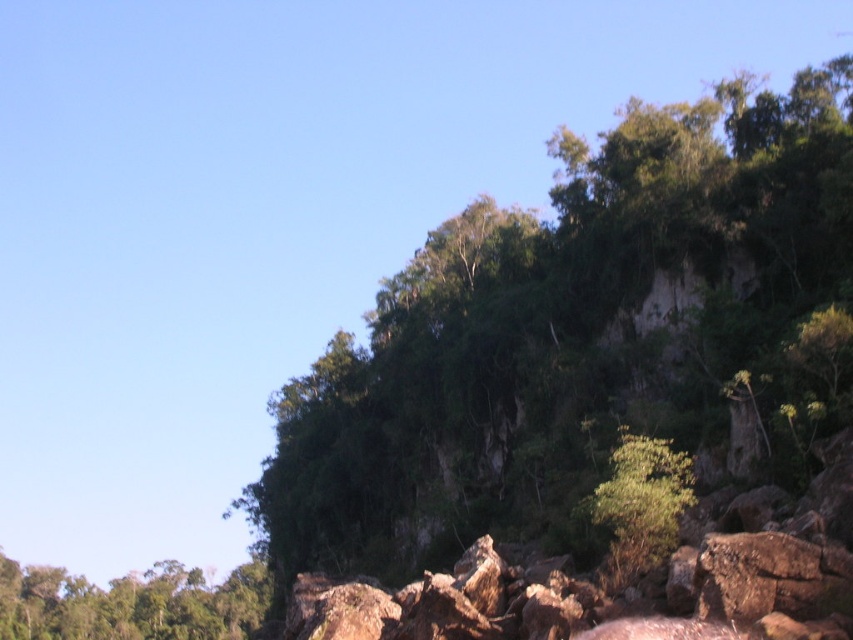
You are an environmental scientist examining the rocky terrain. You notice two green leafy trees in the scene. Which tree, the green leafy tree at upper center or the green leafy tree at center, has a larger size?

The green leafy tree at upper center is bigger than the green leafy tree at center.

You are standing at the point marked by point [131,604] in the image. Looking around, you see a green leafy tree at lower left. Which direction should you face to see the green leafy tree at lower left?

Since the point [131,604] is on the green leafy tree at lower left, you are already facing the tree. Therefore, you should face forward to see the green leafy tree at lower left.

You are a hiker trying to determine which tree to climb for a better view. The green leafy tree at upper center and the green leafy tree at lower left are both options. Which tree is wider and thus more stable for climbing?

The green leafy tree at lower left is wider than the green leafy tree at upper center, making it more stable for climbing.